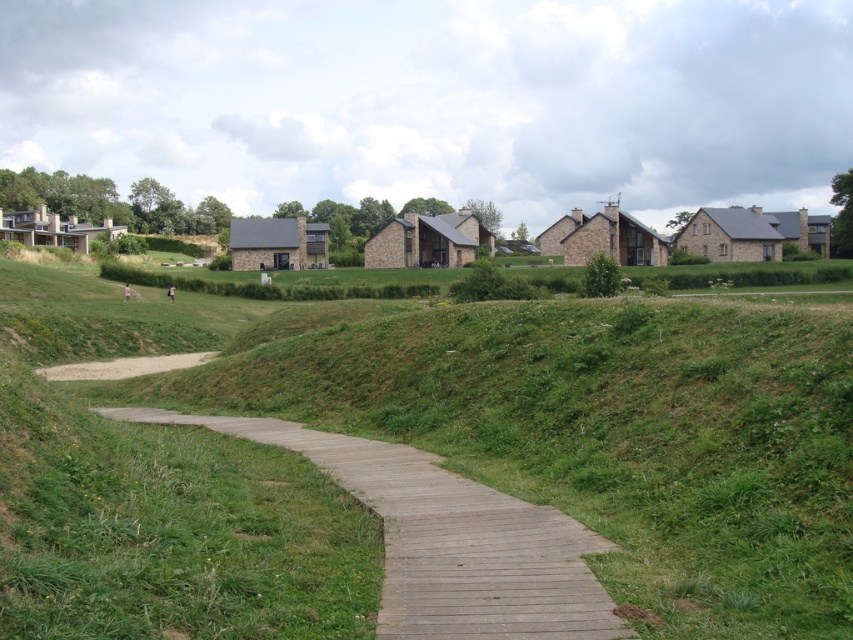
You are a landscape architect designing a new garden. You want to place a decorative fountain between the green grassy at center and the wooden boardwalk at center. Given that the fountain requires a minimum of 10 meters of space between it and the nearest object, will there be enough space?

The green grassy at center is 15.41 meters from the wooden boardwalk at center. Since the fountain requires a minimum of 10 meters of space between it and the nearest object, placing the fountain between them would allow sufficient space as the distance exceeds the required minimum.